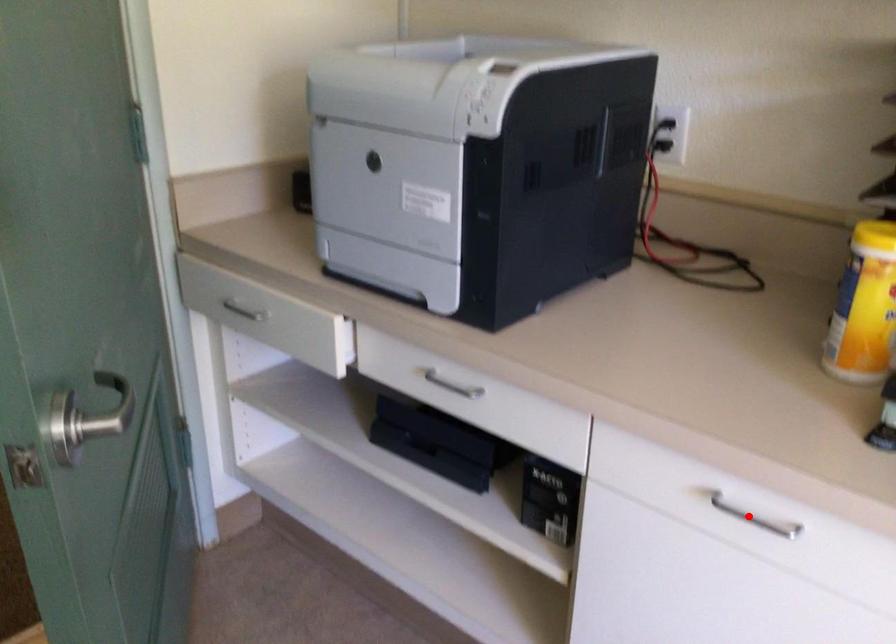
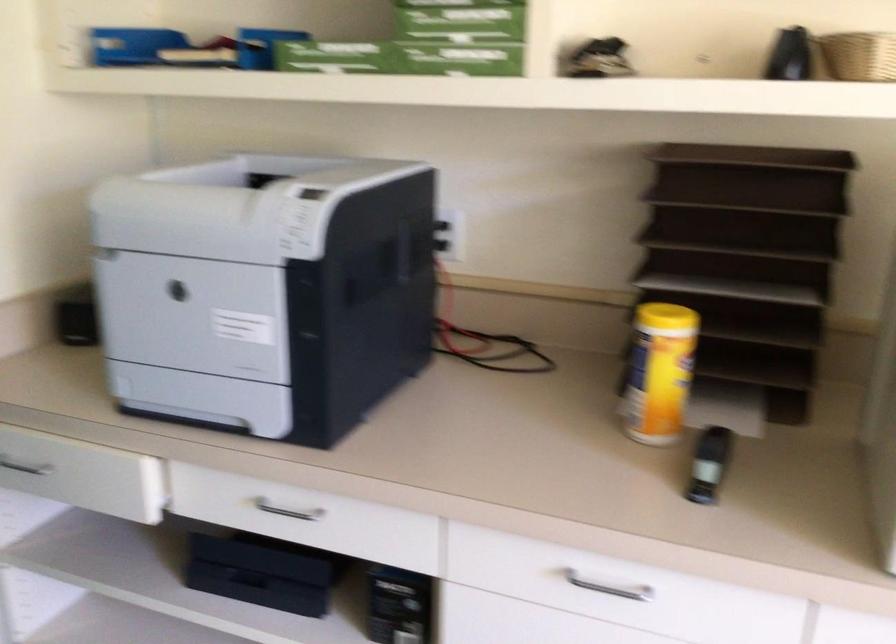
In the second image, find the point that corresponds to the highlighted location in the first image.

(607, 585)